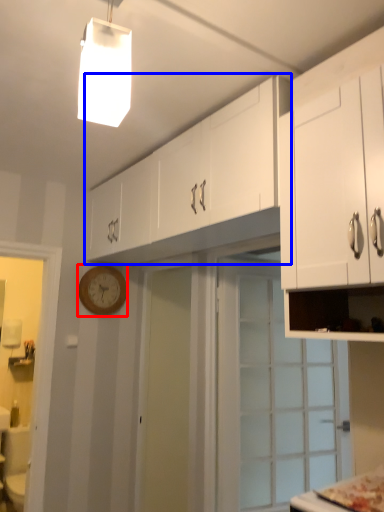
Question: Which object is further to the camera taking this photo, clock (highlighted by a red box) or cabinetry (highlighted by a blue box)?

Choices:
 (A) clock
 (B) cabinetry

Answer: (A)